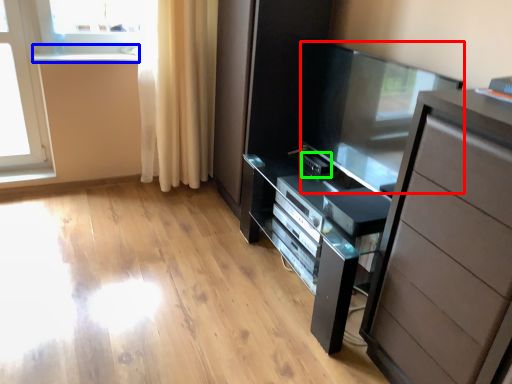
Question: Which is farther away from screen door (highlighted by a red box)? window sill (highlighted by a blue box) or appliance (highlighted by a green box)?

Choices:
 (A) window sill
 (B) appliance

Answer: (A)